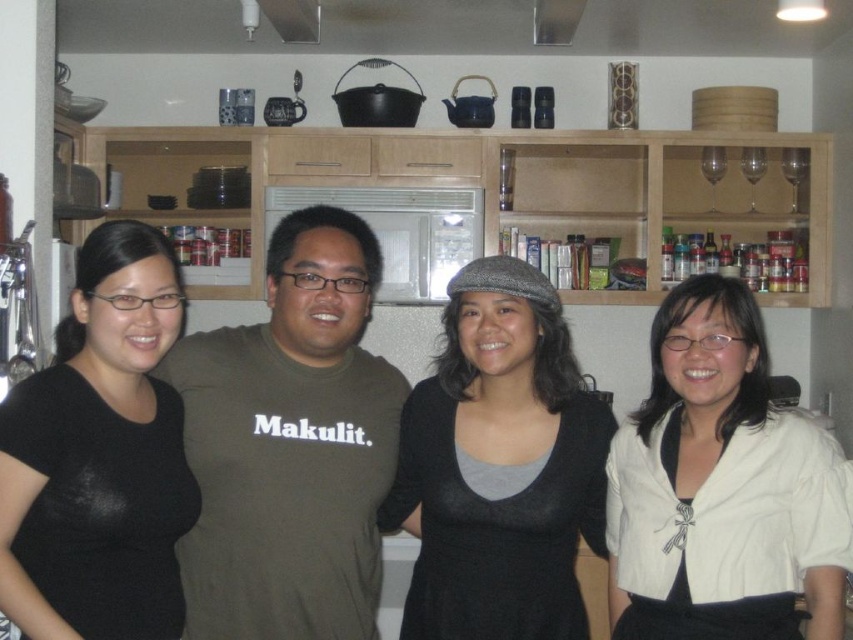
Looking at this image, is white satin blouse at right to the left of dark gray woolen hat at center from the viewer's perspective?

In fact, white satin blouse at right is to the right of dark gray woolen hat at center.

Is white satin blouse at right closer to the viewer compared to dark gray woolen hat at center?

Yes, white satin blouse at right is closer to the viewer.

Describe the element at coordinates (718, 486) in the screenshot. I see `white satin blouse at right` at that location.

Identify the location of white satin blouse at right. This screenshot has width=853, height=640. (718, 486).

Does dark gray woolen hat at center have a greater height compared to black matte shirt at left?

Yes.

Is dark gray woolen hat at center to the right of black matte shirt at left from the viewer's perspective?

Indeed, dark gray woolen hat at center is positioned on the right side of black matte shirt at left.

Who is more distant from viewer, (466,307) or (61,477)?

Positioned behind is point (466,307).

The image size is (853, 640). I want to click on dark gray woolen hat at center, so click(x=498, y=467).

The height and width of the screenshot is (640, 853). Describe the element at coordinates (289, 445) in the screenshot. I see `dark green t-shirt at center` at that location.

Which is behind, point (180, 352) or point (500, 465)?

The point (180, 352) is behind.

This screenshot has height=640, width=853. Identify the location of dark green t-shirt at center. (289, 445).